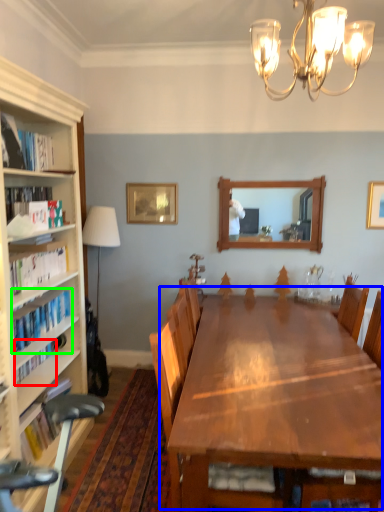
Question: Which is farther away from book (highlighted by a red box)? table (highlighted by a blue box) or book (highlighted by a green box)?

Choices:
 (A) table
 (B) book

Answer: (A)